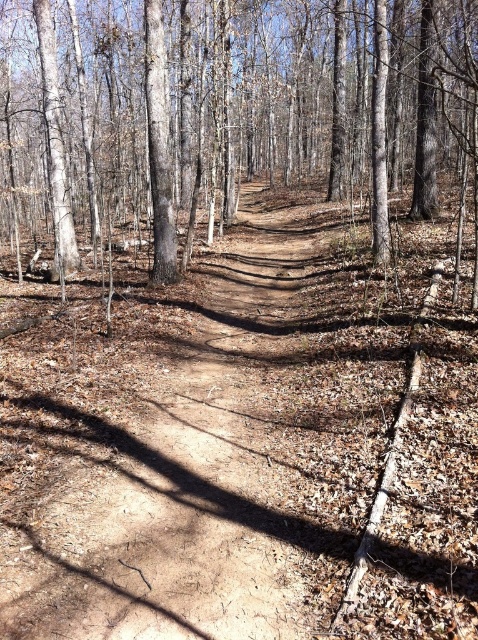
You are a hiker walking along the forest trail and want to reach the point at the bottom right of the image. You see two points marked on your map as point 1 at coordinates point (434, 512) and point 2 at coordinates point (445, 141). Which point is closer to your current position if you are standing at the starting point of the trail?

Point (434, 512) is in front of point (445, 141), so point (434, 512) is closer to your current position.

You are a hiker carrying a 10 meter long rope. You want to tie the rope between the brown dirt track at center and the brown smooth tree at center to mark the trail. Is the rope long enough to stretch between them?

The distance between the brown dirt track at center and the brown smooth tree at center is 12.31 meters. Since the rope is only 10 meters long, it is not long enough to stretch between them.

You are standing on the forest floor covered with brown and orange leaves. You see a point marked at coordinates (243, 442). What is located at that point?

The point at coordinates (243, 442) corresponds to the brown dirt track at center.